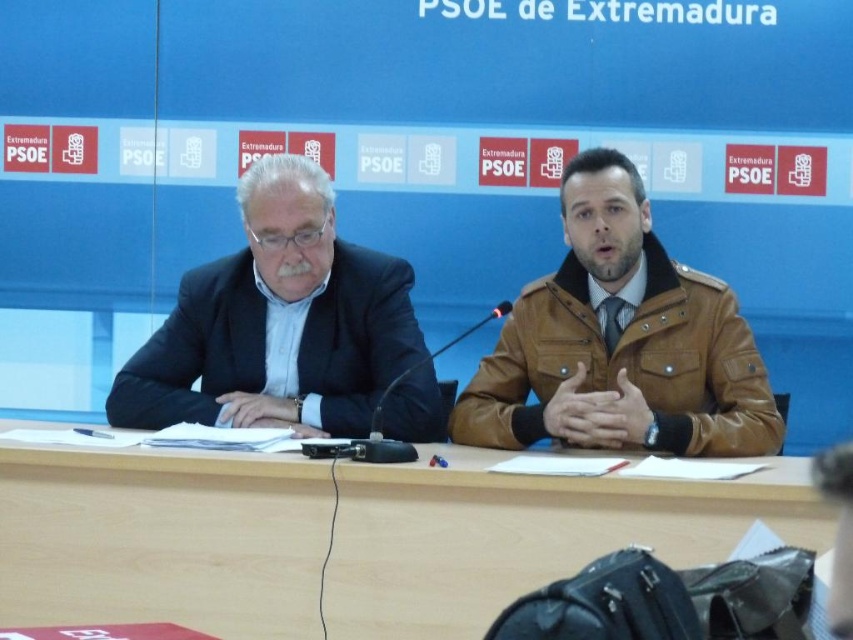
You are a photographer at a press conference and need to capture a clear photo of both the brown leather jacket at center and the matte black suit at left. Since you can only focus on one object at a time, which one should you focus on to ensure it appears sharp in the photo?

The brown leather jacket at center is closer to the viewer than the matte black suit at left, so focusing on it will keep it sharp while the matte black suit at left may appear slightly out of focus. Alternatively, focusing between them might achieve acceptable sharpness for both, but prioritizing the closer object ensures at least one is clear.

You are organizing a small meeting and need to place a laptop on the wooden table at center. The laptop requires a minimum of 30 cm of space. Can the brown leather jacket at center currently on the table be moved to make enough space for the laptop?

The wooden table at center is larger in size than the brown leather jacket at center, so moving the brown leather jacket at center would free up enough space on the wooden table at center to accommodate the laptop requiring 30 cm of space.